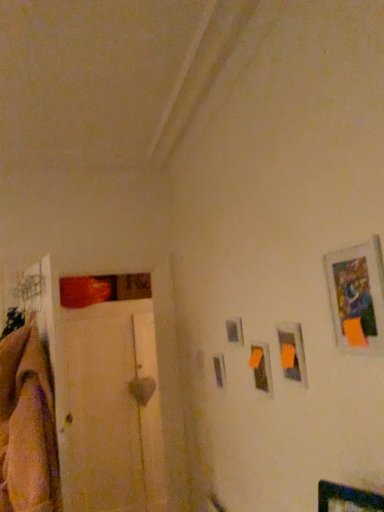
Question: From the image's perspective, is metallic silver picture frame at center-right, marked as the 4th picture frame in a front-to-back arrangement, under soft beige blanket at left?

Choices:
 (A) no
 (B) yes

Answer: (A)

Question: From a real-world perspective, is metallic silver picture frame at center-right, the 1th picture frame viewed from the left, positioned under soft beige blanket at left based on gravity?

Choices:
 (A) no
 (B) yes

Answer: (A)

Question: Is metallic silver picture frame at center-right, marked as the 4th picture frame in a front-to-back arrangement, bigger than soft beige blanket at left?

Choices:
 (A) no
 (B) yes

Answer: (A)

Question: Does metallic silver picture frame at center-right, marked as the 4th picture frame in a front-to-back arrangement, touch soft beige blanket at left?

Choices:
 (A) no
 (B) yes

Answer: (A)

Question: From the image's perspective, is metallic silver picture frame at center-right, the 1th picture frame viewed from the back, on soft beige blanket at left?

Choices:
 (A) yes
 (B) no

Answer: (A)

Question: Is soft beige blanket at left in front of or behind white wood door at left in the image?

Choices:
 (A) front
 (B) behind

Answer: (A)

Question: Considering the positions of soft beige blanket at left and white wood door at left in the image, is soft beige blanket at left taller or shorter than white wood door at left?

Choices:
 (A) short
 (B) tall

Answer: (A)

Question: Is soft beige blanket at left wider or thinner than white wood door at left?

Choices:
 (A) wide
 (B) thin

Answer: (A)

Question: Based on their sizes in the image, would you say soft beige blanket at left is bigger or smaller than white wood door at left?

Choices:
 (A) small
 (B) big

Answer: (A)

Question: In terms of size, does metallic silver picture frame at upper right, acting as the first picture frame starting from the front, appear bigger or smaller than white wood door at left?

Choices:
 (A) big
 (B) small

Answer: (B)

Question: Visually, is metallic silver picture frame at upper right, which is the 4th picture frame from left to right, positioned to the left or to the right of white wood door at left?

Choices:
 (A) left
 (B) right

Answer: (B)

Question: In terms of width, does metallic silver picture frame at upper right, which is the fourth picture frame from back to front, look wider or thinner when compared to white wood door at left?

Choices:
 (A) wide
 (B) thin

Answer: (B)

Question: From the image's perspective, is metallic silver picture frame at upper right, which is the fourth picture frame from back to front, above or below white wood door at left?

Choices:
 (A) below
 (B) above

Answer: (B)

Question: Looking at their shapes, would you say matte plastic picture frame at upper right, acting as the 3th picture frame starting from the left, is wider or thinner than white wood door at left?

Choices:
 (A) thin
 (B) wide

Answer: (A)

Question: In terms of size, does matte plastic picture frame at upper right, placed as the third picture frame when sorted from back to front, appear bigger or smaller than white wood door at left?

Choices:
 (A) small
 (B) big

Answer: (A)